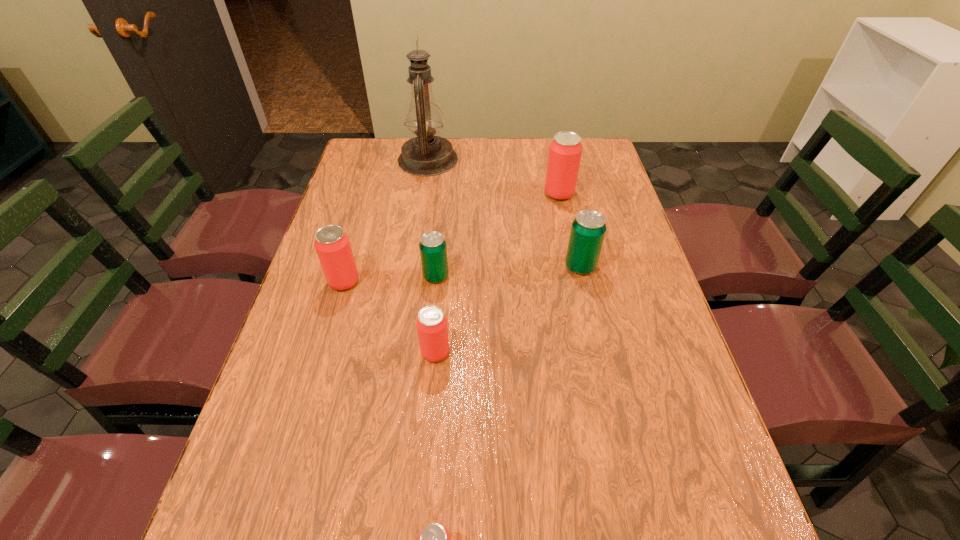
I want to click on vacant space at the far edge of the desktop, so click(505, 161).

In the image, there is a desktop. Find the location of `vacant space at the left edge`. vacant space at the left edge is located at coordinates (320, 473).

Image resolution: width=960 pixels, height=540 pixels. Find the location of `free space at the right edge`. free space at the right edge is located at coordinates (612, 356).

In the image, there is a desktop. Where is `vacant space at the far left corner`? vacant space at the far left corner is located at coordinates (383, 141).

Identify the location of unoccupied position between the second biggest red beer can and the third farthest red beer can. (390, 317).

Identify the location of free space between the tallest object and the bigger teal beer can. This screenshot has width=960, height=540. (504, 213).

Where is `empty space that is in between the farthest beer can and the third nearest red beer can`? Image resolution: width=960 pixels, height=540 pixels. empty space that is in between the farthest beer can and the third nearest red beer can is located at coordinates (451, 238).

Find the location of `vacant area that lies between the oil lamp and the sixth nearest object`. vacant area that lies between the oil lamp and the sixth nearest object is located at coordinates (493, 177).

Find the location of a particular element. free space between the tallest object and the smaller teal beer can is located at coordinates (432, 218).

The width and height of the screenshot is (960, 540). Identify the location of object that is the fifth closest to the nearest beer can. (565, 151).